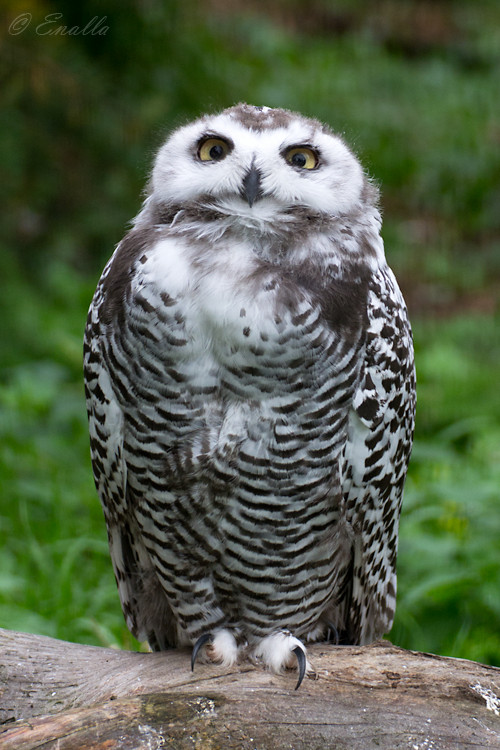
This screenshot has width=500, height=750. What are the coordinates of `white fur` in the screenshot? It's located at (169, 147).